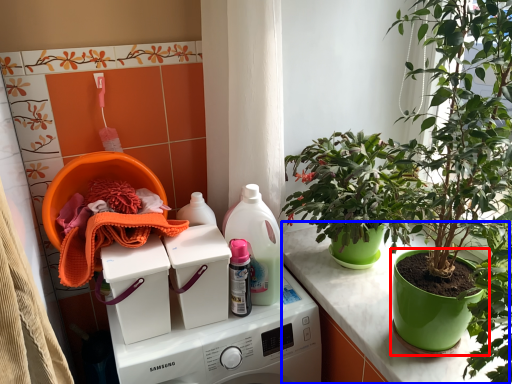
Question: Which point is closer to the camera, flowerpot (highlighted by a red box) or counter (highlighted by a blue box)?

Choices:
 (A) flowerpot
 (B) counter

Answer: (A)